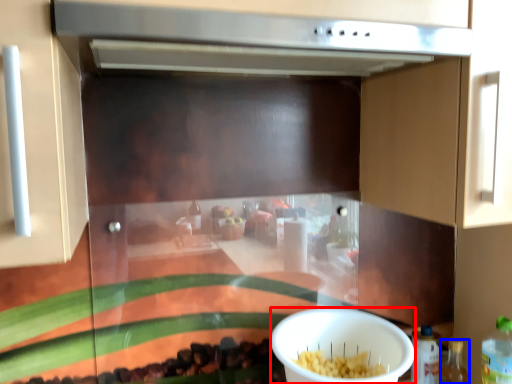
Question: Which object is closer to the camera taking this photo, bowl (highlighted by a red box) or bottle (highlighted by a blue box)?

Choices:
 (A) bowl
 (B) bottle

Answer: (A)